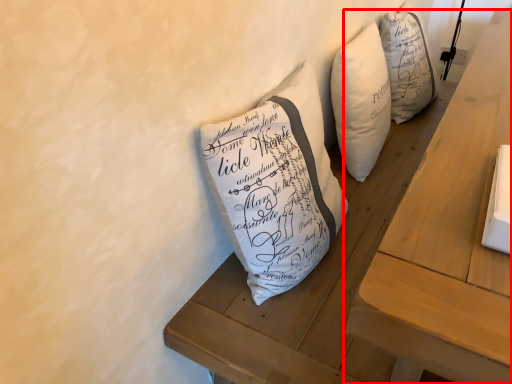
Question: From the image's perspective, what is the correct spatial relationship of table (annotated by the red box) in relation to furniture?

Choices:
 (A) above
 (B) below

Answer: (A)